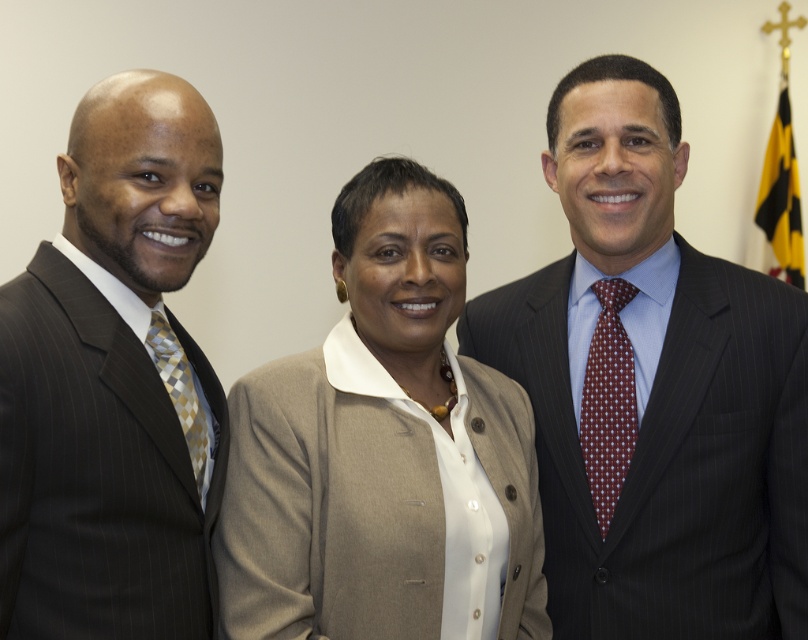
You are a photographer setting up for a group photo. You notice the dark pinstripe suit at center and the maroon dotted tie at right in the scene. Based on their positions, which one is higher up in the frame?

The dark pinstripe suit at center is above the maroon dotted tie at right in the frame.

You are a photographer setting up for a group photo. You need to ensure that the dark pinstripe suit at center and the maroon dotted tie at right are at least 5 inches apart to avoid overlapping in the final shot. Based on the current arrangement, will this requirement be met?

The dark pinstripe suit at center and maroon dotted tie at right are 4.53 inches apart from each other, which is less than the required 5 inches. Therefore, the requirement will not be met, and adjustments are needed to increase the distance between them.

You are a photographer setting up for a group photo. You need to ensure that the dark pinstripe suit at center and the maroon dotted tie at right are both visible in the frame. Given their sizes, which object should you prioritize keeping closer to the camera to avoid being cut off?

The dark pinstripe suit at center is wider than the maroon dotted tie at right, so you should prioritize keeping the dark pinstripe suit at center closer to the camera to ensure it remains visible in the frame.